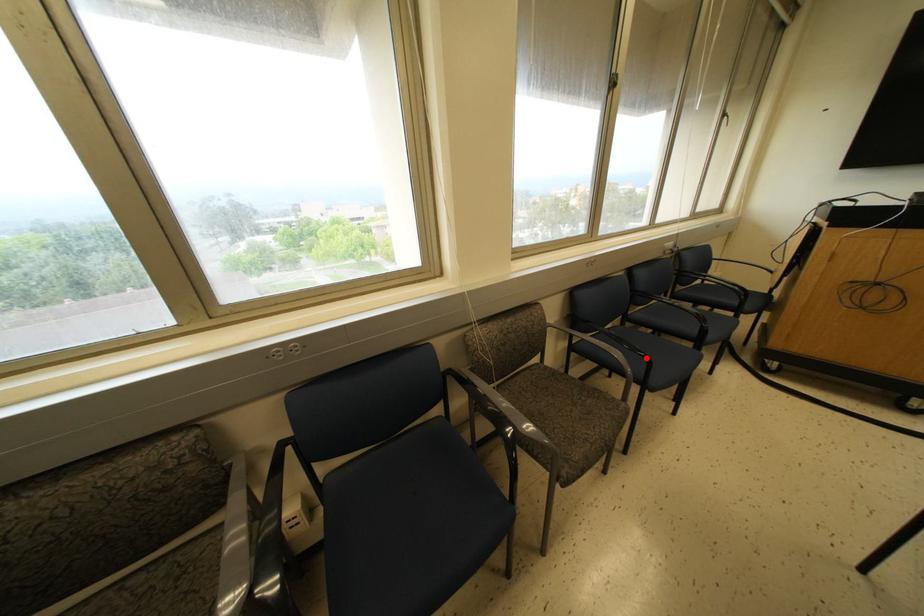
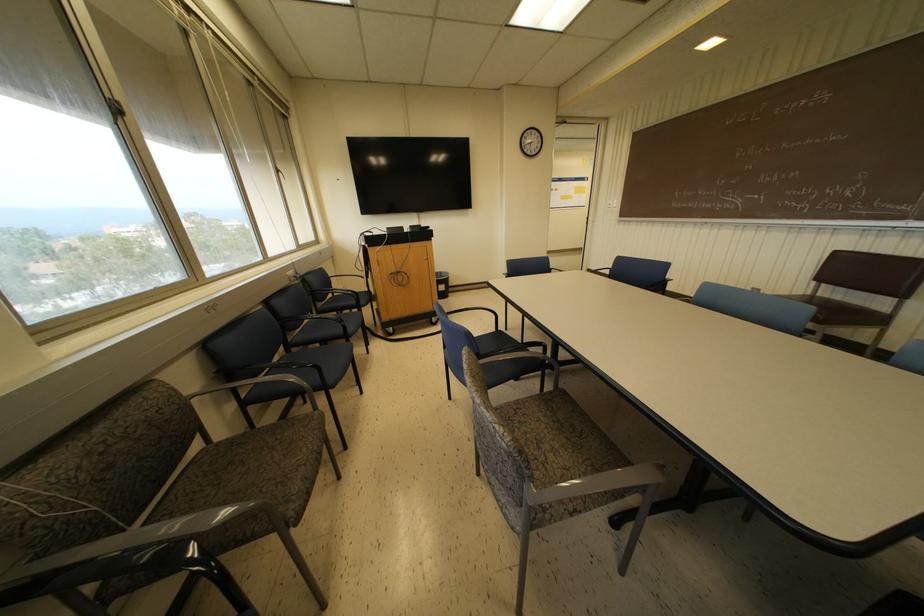
Question: A red point is marked in image1. In image2, is the corresponding 3D point closer to the camera or farther? Reply with the corresponding letter.

Choices:
 (A) The corresponding 3D point is closer.
 (B) The corresponding 3D point is farther.

Answer: (A)